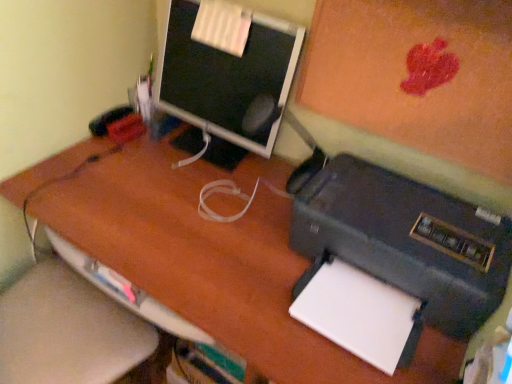
Locate an element on the screen. This screenshot has height=384, width=512. free space in front of matte black monitor at upper center is located at coordinates (176, 193).